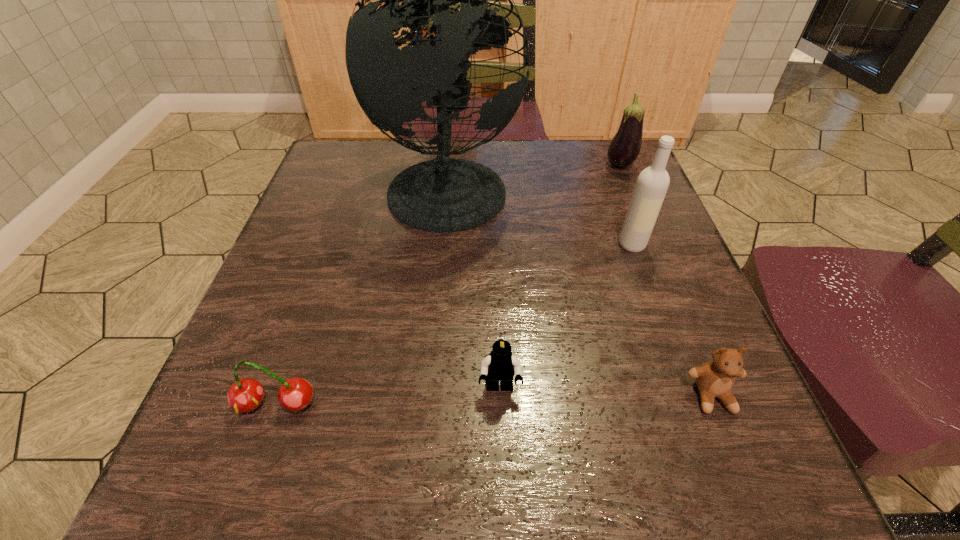
I want to click on free spot located 0.060m on the front-facing side of the Lego, so click(501, 440).

Where is `vacant space located on the front-facing side of the teddy bear`? This screenshot has height=540, width=960. vacant space located on the front-facing side of the teddy bear is located at coordinates (750, 490).

Identify the location of globe present at the far edge. The image size is (960, 540). (444, 195).

The height and width of the screenshot is (540, 960). Find the location of `eggplant present at the far edge`. eggplant present at the far edge is located at coordinates (625, 146).

At what (x,y) coordinates should I click in order to perform the action: click on globe located in the left edge section of the desktop. Please return your answer as a coordinate pair (x, y). Looking at the image, I should click on (444, 195).

Image resolution: width=960 pixels, height=540 pixels. Identify the location of cherry at the left edge. tap(295, 394).

The width and height of the screenshot is (960, 540). Find the location of `vodka present at the right edge`. vodka present at the right edge is located at coordinates (652, 184).

Identify the location of eggplant positioned at the right edge. The width and height of the screenshot is (960, 540). (625, 146).

This screenshot has width=960, height=540. Identify the location of teddy bear that is at the right edge. (715, 378).

Where is `object at the far left corner`? object at the far left corner is located at coordinates (444, 195).